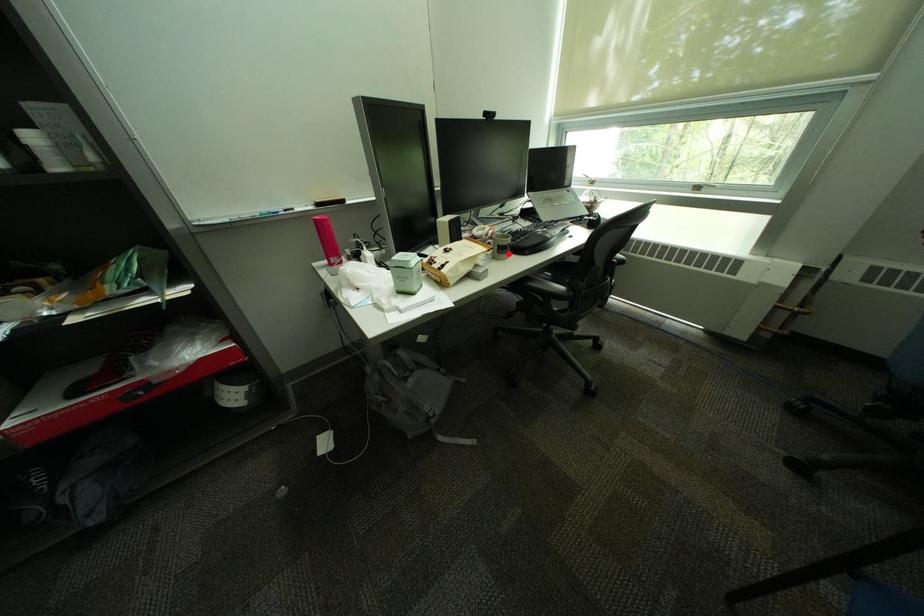
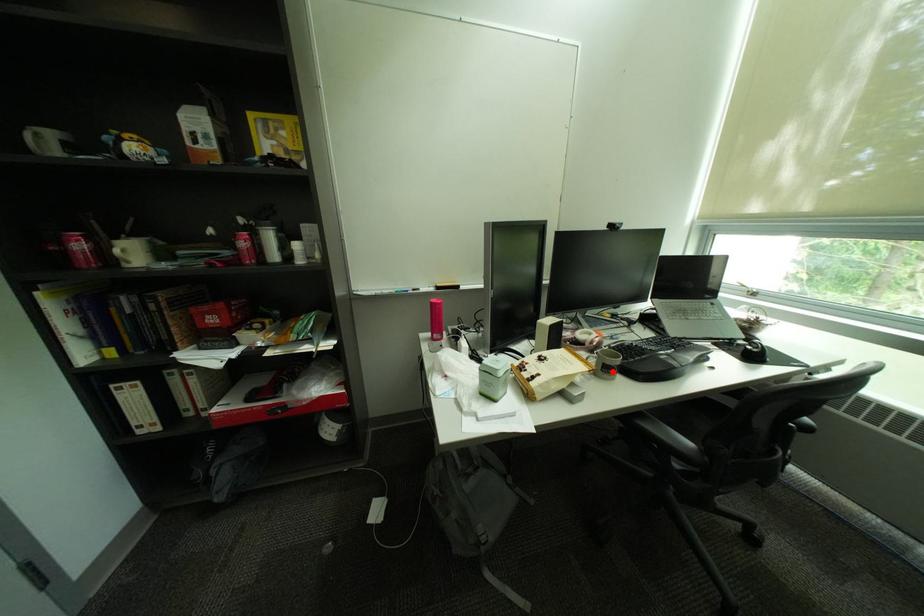
I am providing you with two images of the same scene from different viewpoints. A red point is marked on the first image and another point is marked on the second image. Are the points marked in image1 and image2 representing the same 3D position?

Yes